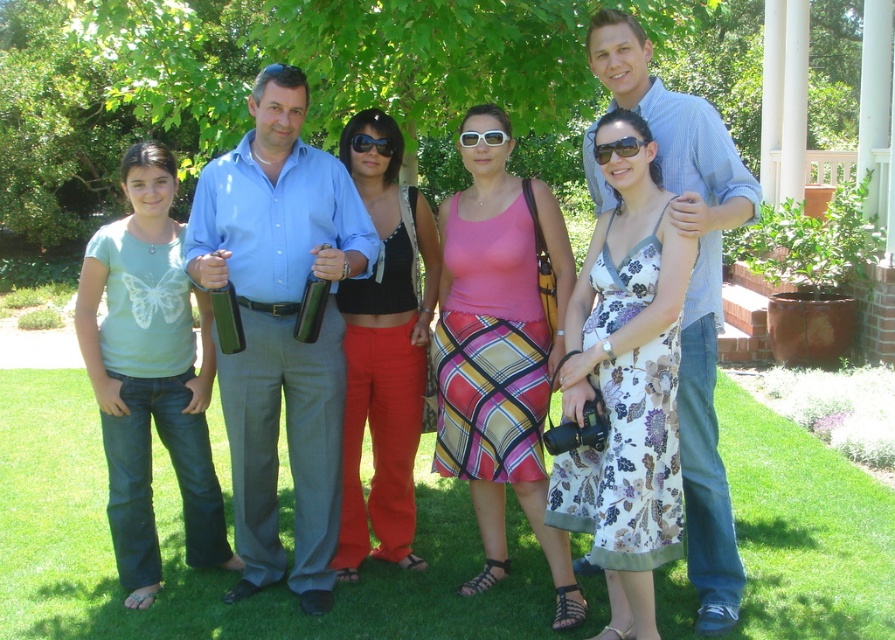
You are a photographer trying to capture a clear photo of the blue cotton shirt at center and the white plastic sunglasses at center. Which object should you focus on first to ensure it appears sharp in the photo?

The blue cotton shirt at center is much taller than the white plastic sunglasses at center, so you should focus on the blue cotton shirt at center first to ensure it appears sharp in the photo.